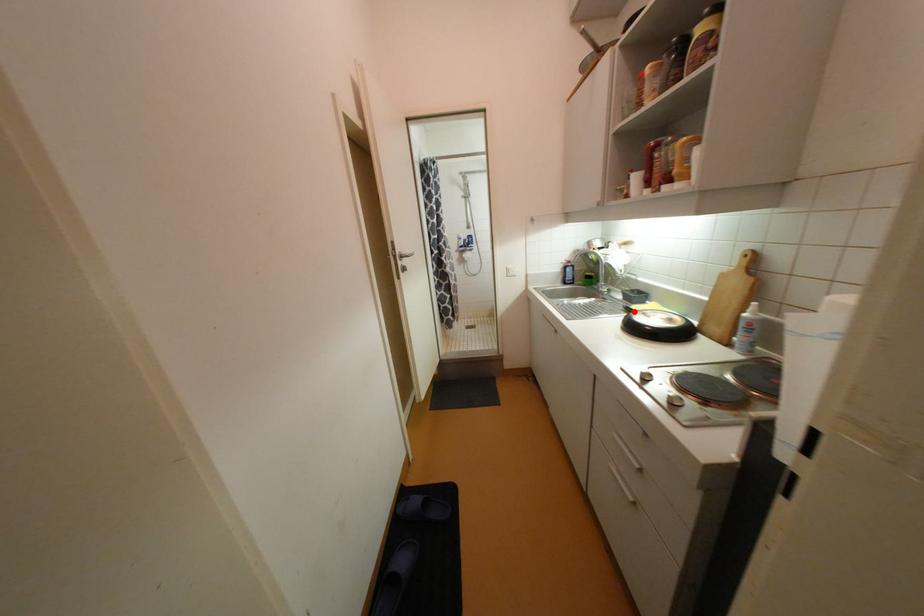
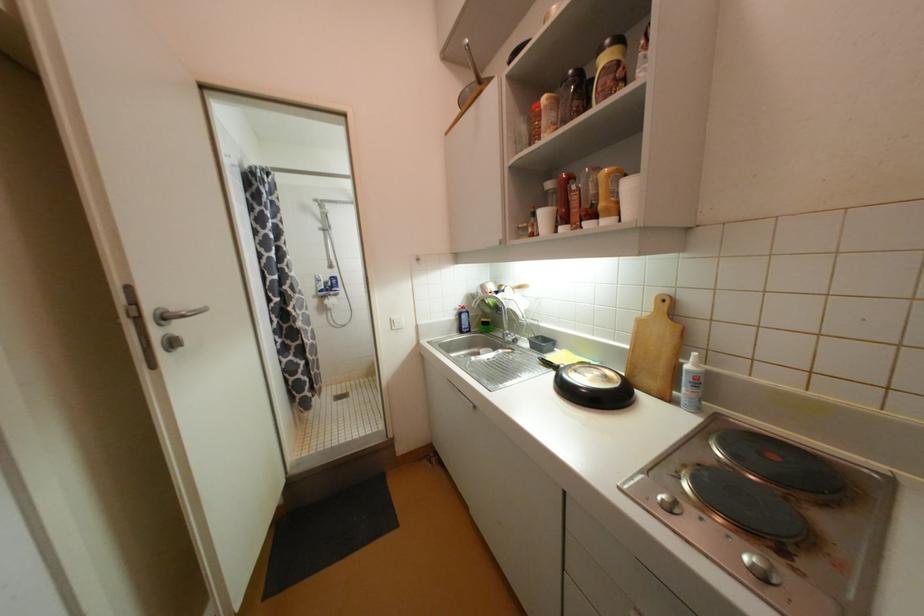
The point at the highlighted location is marked in the first image. Where is the corresponding point in the second image?

(553, 365)